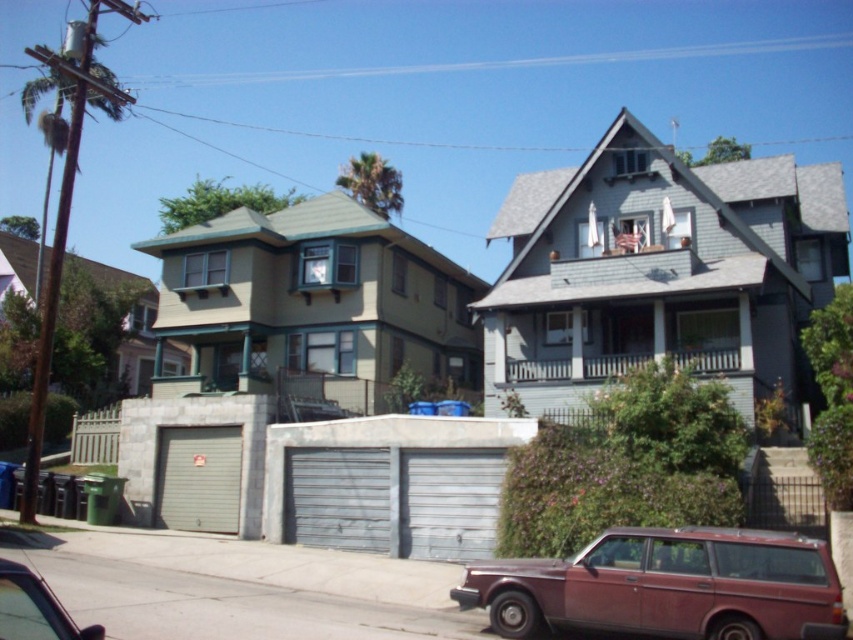
You are a delivery person driving a truck that is 2 meters wide. You need to park between the rustic maroon station wagon at lower center and the metallic red car at lower left. Can you fit your truck between them?

The rustic maroon station wagon at lower center is further to the viewer than the metallic red car at lower left, so the distance between them may not be sufficient for a 2 meter wide truck. You should check the space carefully before attempting to park.

You are a delivery driver trying to park your rustic maroon station wagon at lower center in the gray wood garage at upper right. Based on the scene description, will the garage be wide enough to accommodate your vehicle?

The gray wood garage at upper right is wider than the rustic maroon station wagon at lower center, so the garage should be wide enough to accommodate the vehicle.